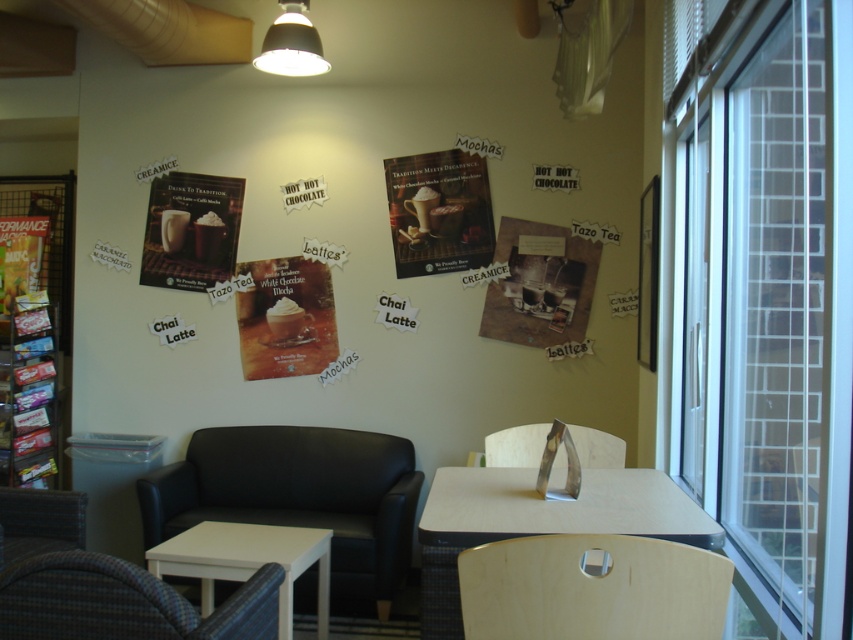
Question: Which point is farther to the camera?

Choices:
 (A) matte paper poster at center
 (B) matte white lampshade at upper center

Answer: (A)

Question: Is woven rattan armchair at lower left to the right of matte green poster at left from the viewer's perspective?

Choices:
 (A) no
 (B) yes

Answer: (B)

Question: Is matte paper poster at upper left bigger than matte white lampshade at upper center?

Choices:
 (A) no
 (B) yes

Answer: (A)

Question: Which object is farther from the camera taking this photo?

Choices:
 (A) matte white poster at center
 (B) woven rattan armchair at lower left
 (C) plaid fabric armchair at lower left

Answer: (A)

Question: Does black leather armchair at center come behind light brown wood armchair at lower right?

Choices:
 (A) no
 (B) yes

Answer: (B)

Question: Based on their relative distances, which object is farther from the metallic silver armchair at center?

Choices:
 (A) matte white poster at center
 (B) metallic silver bookshelf at left
 (C) white matte side table at lower left
 (D) white matte table at center

Answer: (B)